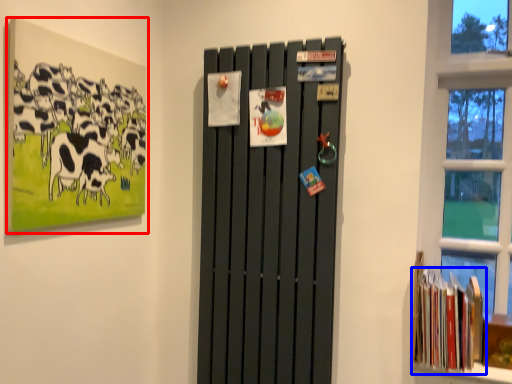
Question: Which object appears closest to the camera in this image, picture frame (highlighted by a red box) or book (highlighted by a blue box)?

Choices:
 (A) picture frame
 (B) book

Answer: (A)